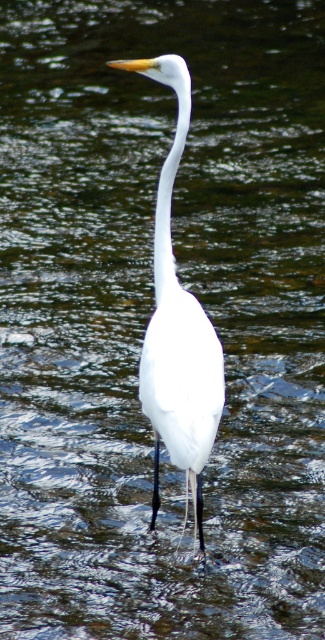
Question: Is white smooth bird at center thinner than white smooth neck at center?

Choices:
 (A) yes
 (B) no

Answer: (B)

Question: Is white smooth bird at center smaller than white smooth neck at center?

Choices:
 (A) yes
 (B) no

Answer: (B)

Question: Can you confirm if white smooth bird at center is bigger than white smooth neck at center?

Choices:
 (A) yes
 (B) no

Answer: (A)

Question: Which object is farther from the camera taking this photo?

Choices:
 (A) white smooth neck at center
 (B) white smooth bird at center

Answer: (A)

Question: Among these objects, which one is farthest from the camera?

Choices:
 (A) white smooth neck at center
 (B) white smooth bird at center

Answer: (A)